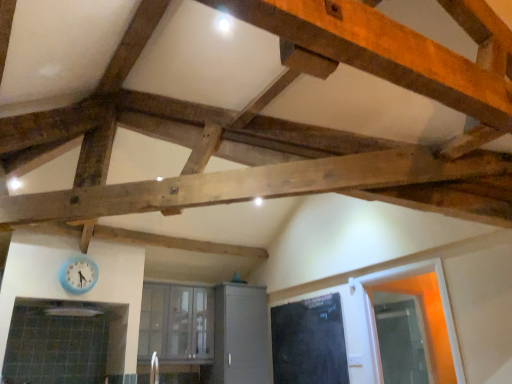
Question: Is the depth of transparent glass door at right greater than that of clear glass window at center?

Choices:
 (A) yes
 (B) no

Answer: (B)

Question: Could clear glass window at center be considered to be inside transparent glass door at right?

Choices:
 (A) yes
 (B) no

Answer: (B)

Question: From the image's perspective, would you say transparent glass door at right is shown under clear glass window at center?

Choices:
 (A) yes
 (B) no

Answer: (B)

Question: Is transparent glass door at right positioned with its back to clear glass window at center?

Choices:
 (A) no
 (B) yes

Answer: (A)

Question: Is transparent glass door at right not near clear glass window at center?

Choices:
 (A) yes
 (B) no

Answer: (A)

Question: From the image's perspective, is clear glass window at center positioned above or below black matte door at center?

Choices:
 (A) below
 (B) above

Answer: (B)

Question: In terms of height, does clear glass window at center look taller or shorter compared to black matte door at center?

Choices:
 (A) short
 (B) tall

Answer: (B)

Question: In terms of size, does clear glass window at center appear bigger or smaller than black matte door at center?

Choices:
 (A) big
 (B) small

Answer: (A)

Question: From a real-world perspective, relative to black matte door at center, is clear glass window at center vertically above or below?

Choices:
 (A) above
 (B) below

Answer: (A)

Question: Based on their positions, is black matte door at center located to the left or right of blue plastic clock at lower left?

Choices:
 (A) right
 (B) left

Answer: (A)

Question: In terms of width, does black matte door at center look wider or thinner when compared to blue plastic clock at lower left?

Choices:
 (A) wide
 (B) thin

Answer: (B)

Question: Relative to blue plastic clock at lower left, is black matte door at center in front or behind?

Choices:
 (A) behind
 (B) front

Answer: (A)

Question: From a real-world perspective, relative to blue plastic clock at lower left, is black matte door at center vertically above or below?

Choices:
 (A) below
 (B) above

Answer: (A)

Question: Is black matte door at center to the left or to the right of clear glass window at center in the image?

Choices:
 (A) right
 (B) left

Answer: (A)

Question: From a real-world perspective, is black matte door at center physically located above or below clear glass window at center?

Choices:
 (A) above
 (B) below

Answer: (B)